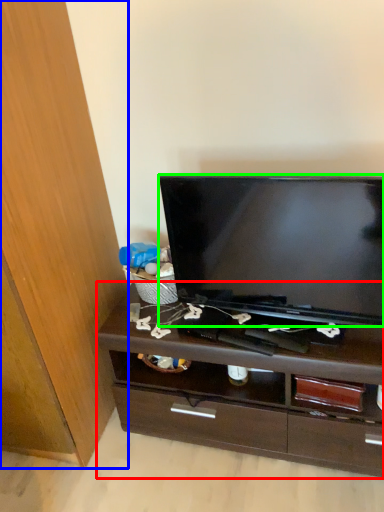
Question: Which is nearer to the chest of drawers (highlighted by a red box)? cabinetry (highlighted by a blue box) or television (highlighted by a green box).

Choices:
 (A) cabinetry
 (B) television

Answer: (B)